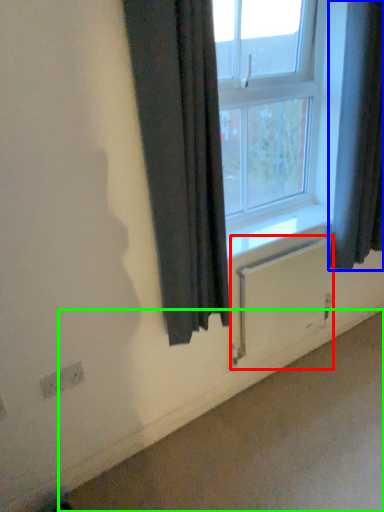
Question: Which object is positioned farthest from radiator (highlighted by a red box)? Select from curtain (highlighted by a blue box) and concrete (highlighted by a green box).

Choices:
 (A) curtain
 (B) concrete

Answer: (B)